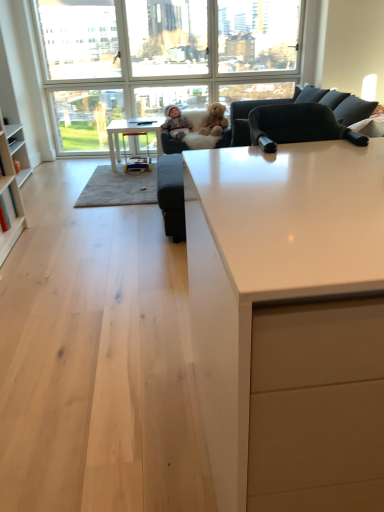
At what (x,y) coordinates should I click in order to perform the action: click on clear glass window at upper center. Please return your answer as a coordinate pair (x, y). The width and height of the screenshot is (384, 512). Looking at the image, I should click on (170, 49).

What do you see at coordinates (170, 49) in the screenshot?
I see `clear glass window at upper center` at bounding box center [170, 49].

Where is `white glossy countertop at center`? This screenshot has height=512, width=384. white glossy countertop at center is located at coordinates (289, 323).

What is the approximate height of fluffy plush at center?

It is 21.71 inches.

Locate an element on the screen. Image resolution: width=384 pixels, height=512 pixels. fluffy plush at center is located at coordinates (203, 128).

At what (x,y) coordinates should I click in order to perform the action: click on fluffy beige teddy bear at center. Please return your answer as a coordinate pair (x, y). This screenshot has width=384, height=512. Looking at the image, I should click on (214, 120).

Measure the distance between point (x=118, y=144) and camera.

Point (x=118, y=144) is 4.86 meters from camera.

This screenshot has height=512, width=384. Find the location of `clear glass window at upper center`. clear glass window at upper center is located at coordinates (170, 49).

From the image's perspective, which is above, matte gray baby at center or white glossy countertop at center?

matte gray baby at center appears higher in the image.

Does matte gray baby at center have a lesser width compared to white glossy countertop at center?

Yes.

Who is taller, matte gray baby at center or white glossy countertop at center?

white glossy countertop at center.

Is matte gray baby at center outside of white glossy countertop at center?

That's correct, matte gray baby at center is outside of white glossy countertop at center.

Is clear glass window at upper center smaller than white glossy table at center?

Incorrect, clear glass window at upper center is not smaller in size than white glossy table at center.

From the image's perspective, would you say clear glass window at upper center is positioned over white glossy table at center?

Yes.

In the scene shown: Which is less distant, (77, 18) or (120, 157)?

Point (77, 18) is closer to the camera than point (120, 157).

Is clear glass window at upper center not near white glossy table at center?

No, clear glass window at upper center is not far from white glossy table at center.

Based on the photo, considering the sizes of fluffy beige teddy bear at center and clear glass window at upper center in the image, is fluffy beige teddy bear at center wider or thinner than clear glass window at upper center?

Clearly, fluffy beige teddy bear at center has more width compared to clear glass window at upper center.

Between point (215, 134) and point (236, 40), which one is positioned in front?

The point (215, 134) is closer.

Is fluffy beige teddy bear at center spatially inside clear glass window at upper center, or outside of it?

fluffy beige teddy bear at center is not inside clear glass window at upper center, it's outside.

Does fluffy beige teddy bear at center have a greater height compared to clear glass window at upper center?

No, fluffy beige teddy bear at center is not taller than clear glass window at upper center.

Consider the image. Is clear glass window at upper center not near fluffy beige teddy bear at center?

No.

Is clear glass window at upper center facing towards fluffy beige teddy bear at center?

Yes, clear glass window at upper center is aimed at fluffy beige teddy bear at center.

Image resolution: width=384 pixels, height=512 pixels. Identify the location of window above the fluffy beige teddy bear at center (from a real-world perspective). (170, 49).

Considering the sizes of objects fluffy beige teddy bear at center and white glossy countertop at center in the image provided, who is shorter, fluffy beige teddy bear at center or white glossy countertop at center?

fluffy beige teddy bear at center.

In order to click on toddler located above the white glossy countertop at center (from the image's perspective) in this screenshot , I will do `click(214, 120)`.

From the image's perspective, which one is positioned higher, fluffy beige teddy bear at center or white glossy countertop at center?

fluffy beige teddy bear at center is shown above in the image.

How distant is fluffy beige teddy bear at center from white glossy countertop at center?

fluffy beige teddy bear at center is 3.88 meters away from white glossy countertop at center.

Can you tell me how much wooden stool at center and white glossy countertop at center differ in facing direction?

178 degrees separate the facing orientations of wooden stool at center and white glossy countertop at center.

Which point is more forward, (147,163) or (335,330)?

The point (335,330) is more forward.

Which of these two, wooden stool at center or white glossy countertop at center, stands taller?

white glossy countertop at center.

Are wooden stool at center and white glossy countertop at center located far from each other?

That's right, there is a large distance between wooden stool at center and white glossy countertop at center.

Would you say clear glass window at upper center is a long distance from wooden stool at center?

Absolutely, clear glass window at upper center is distant from wooden stool at center.

Who is taller, clear glass window at upper center or wooden stool at center?

With more height is clear glass window at upper center.

How much distance is there between clear glass window at upper center and wooden stool at center?

A distance of 3.88 feet exists between clear glass window at upper center and wooden stool at center.

Is clear glass window at upper center oriented away from wooden stool at center?

That's not correct — clear glass window at upper center is not looking away from wooden stool at center.

The height and width of the screenshot is (512, 384). Find the location of `countertop below the matte gray baby at center (from the image's perspective)`. countertop below the matte gray baby at center (from the image's perspective) is located at coordinates (289, 323).

Identify the location of table on the left of the clear glass window at upper center. (132, 134).

From the image, which object appears to be farther from white glossy countertop at center, clear glass window at upper center or wooden stool at center?

The object further to white glossy countertop at center is clear glass window at upper center.

Consider the image. Looking at the image, which one is located closer to fluffy plush at center, wooden stool at center or fluffy beige teddy bear at center?

fluffy beige teddy bear at center is closer to fluffy plush at center.

Which object lies further to the anchor point fluffy beige teddy bear at center, clear glass window at upper center or fluffy plush at center?

The object further to fluffy beige teddy bear at center is clear glass window at upper center.

When comparing their distances from clear glass window at upper center, does white glossy countertop at center or matte gray baby at center seem closer?

matte gray baby at center lies closer to clear glass window at upper center than the other object.

Looking at the image, which one is located further to white glossy countertop at center, fluffy beige teddy bear at center or clear glass window at upper center?

The object further to white glossy countertop at center is clear glass window at upper center.

Considering their positions, is matte gray baby at center positioned further to white glossy countertop at center than fluffy beige teddy bear at center?

fluffy beige teddy bear at center is positioned further to the anchor white glossy countertop at center.

Estimate the real-world distances between objects in this image. Which object is closer to white glossy countertop at center, fluffy beige teddy bear at center or matte gray baby at center?

The object closer to white glossy countertop at center is matte gray baby at center.

Based on their spatial positions, is wooden stool at center or clear glass window at upper center closer to matte gray baby at center?

wooden stool at center.

Find the location of `stool between white glossy table at center and fluffy plush at center from left to right`. stool between white glossy table at center and fluffy plush at center from left to right is located at coordinates (137, 156).

The width and height of the screenshot is (384, 512). In order to click on toddler between clear glass window at upper center and matte gray baby at center vertically in this screenshot , I will do `click(214, 120)`.

The width and height of the screenshot is (384, 512). Find the location of `person located between white glossy table at center and fluffy beige teddy bear at center in the left-right direction`. person located between white glossy table at center and fluffy beige teddy bear at center in the left-right direction is located at coordinates (176, 123).

Where is `person located between wooden stool at center and fluffy plush at center in the left-right direction`? The width and height of the screenshot is (384, 512). person located between wooden stool at center and fluffy plush at center in the left-right direction is located at coordinates (176, 123).